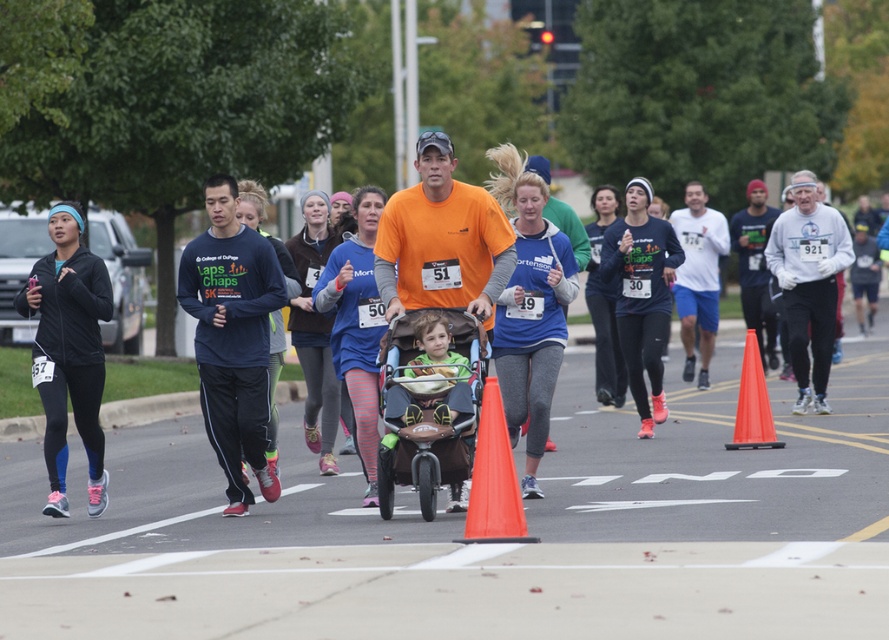
Question: Can you confirm if black matte running shoes at left is smaller than orange plastic traffic cone at center?

Choices:
 (A) yes
 (B) no

Answer: (B)

Question: Which of the following is the closest to the observer?

Choices:
 (A) orange plastic cone at center-right
 (B) brown fabric stroller at center

Answer: (B)

Question: Which is farther from the orange plastic cone at center-right?

Choices:
 (A) black matte running shoes at left
 (B) brown fabric stroller at center

Answer: (A)

Question: Based on their relative distances, which object is farther from the black matte running shoes at left?

Choices:
 (A) brown fabric stroller at center
 (B) dark blue long-sleeve shirt at left
 (C) orange plastic traffic cone at center

Answer: (C)

Question: Can you confirm if dark blue long-sleeve shirt at left is positioned below brown fabric stroller at center?

Choices:
 (A) yes
 (B) no

Answer: (B)

Question: Does brown fabric stroller at center appear under orange plastic traffic cone at center?

Choices:
 (A) yes
 (B) no

Answer: (B)